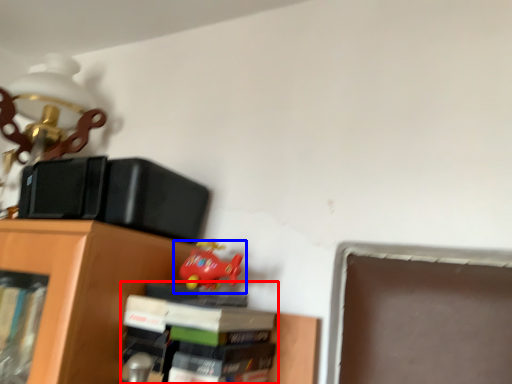
Question: Which of the following is the farthest to the observer, book (highlighted by a red box) or toy (highlighted by a blue box)?

Choices:
 (A) book
 (B) toy

Answer: (B)